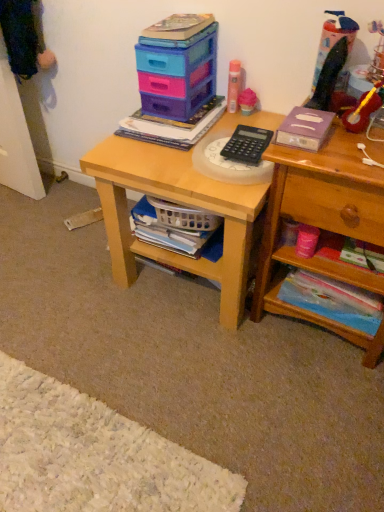
Question: Considering the relative sizes of purple matte book at upper right, which is the 3th book from bottom to top, and white plastic basket at lower center, acting as the third book starting from the top, in the image provided, is purple matte book at upper right, which is the 3th book from bottom to top, thinner than white plastic basket at lower center, acting as the third book starting from the top,?

Choices:
 (A) no
 (B) yes

Answer: (B)

Question: Can you confirm if purple matte book at upper right, which is the 3th book from bottom to top, is taller than white plastic basket at lower center, which ranks as the second book in bottom-to-top order?

Choices:
 (A) no
 (B) yes

Answer: (A)

Question: Is purple matte book at upper right, the 2th book in the top-to-bottom sequence, bigger than white plastic basket at lower center, acting as the third book starting from the top?

Choices:
 (A) no
 (B) yes

Answer: (A)

Question: From a real-world perspective, is purple matte book at upper right, which is the 3th book from bottom to top, under white plastic basket at lower center, which ranks as the second book in bottom-to-top order?

Choices:
 (A) yes
 (B) no

Answer: (B)

Question: Is purple matte book at upper right, which is the 3th book from bottom to top, positioned far away from white plastic basket at lower center, which ranks as the second book in bottom-to-top order?

Choices:
 (A) yes
 (B) no

Answer: (B)

Question: Considering their positions, is plastic storage boxes at upper center located in front of or behind black plastic calculator at center?

Choices:
 (A) behind
 (B) front

Answer: (A)

Question: Is point (193, 69) closer or farther from the camera than point (269, 133)?

Choices:
 (A) farther
 (B) closer

Answer: (A)

Question: Is plastic storage boxes at upper center to the left or to the right of black plastic calculator at center in the image?

Choices:
 (A) right
 (B) left

Answer: (B)

Question: From a real-world perspective, is plastic storage boxes at upper center physically located above or below black plastic calculator at center?

Choices:
 (A) below
 (B) above

Answer: (B)

Question: From the image's perspective, is matte plastic book at center, the fourth book from the bottom, positioned above or below pink matte spray can at upper center, positioned as the 4th toy in right-to-left order?

Choices:
 (A) below
 (B) above

Answer: (A)

Question: Looking at the image, does matte plastic book at center, which is the 1th book in top-to-bottom order, seem bigger or smaller compared to pink matte spray can at upper center, positioned as the first toy in left-to-right order?

Choices:
 (A) big
 (B) small

Answer: (A)

Question: Is matte plastic book at center, the fourth book from the bottom, taller or shorter than pink matte spray can at upper center, positioned as the first toy in left-to-right order?

Choices:
 (A) short
 (B) tall

Answer: (A)

Question: Choose the correct answer: Is matte plastic book at center, the fourth book from the bottom, inside pink matte spray can at upper center, positioned as the first toy in left-to-right order, or outside it?

Choices:
 (A) outside
 (B) inside

Answer: (A)

Question: From the image's perspective, is translucent plastic toy at upper right, the 3th toy from the left, above or below matte plastic book at center, which is the 1th book in top-to-bottom order?

Choices:
 (A) below
 (B) above

Answer: (B)

Question: Considering the relative positions of translucent plastic toy at upper right, the 3th toy from the left, and matte plastic book at center, the fourth book from the bottom, in the image provided, is translucent plastic toy at upper right, the 3th toy from the left, to the left or to the right of matte plastic book at center, the fourth book from the bottom,?

Choices:
 (A) left
 (B) right

Answer: (B)